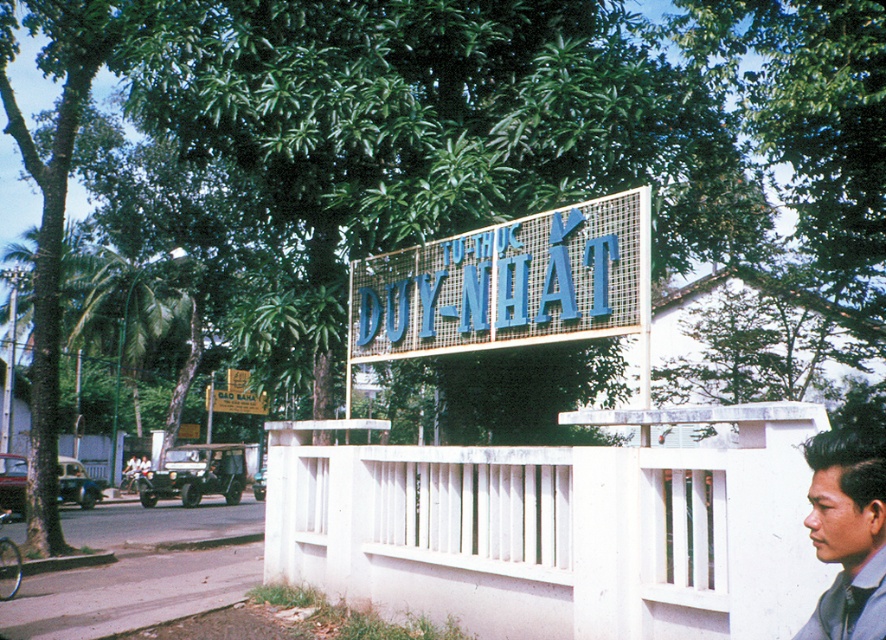
Can you confirm if blue metallic sign at center is smaller than matte blue shirt at lower right?

No.

Does blue metallic sign at center come behind matte blue shirt at lower right?

Yes.

In order to click on blue metallic sign at center in this screenshot , I will do `click(507, 284)`.